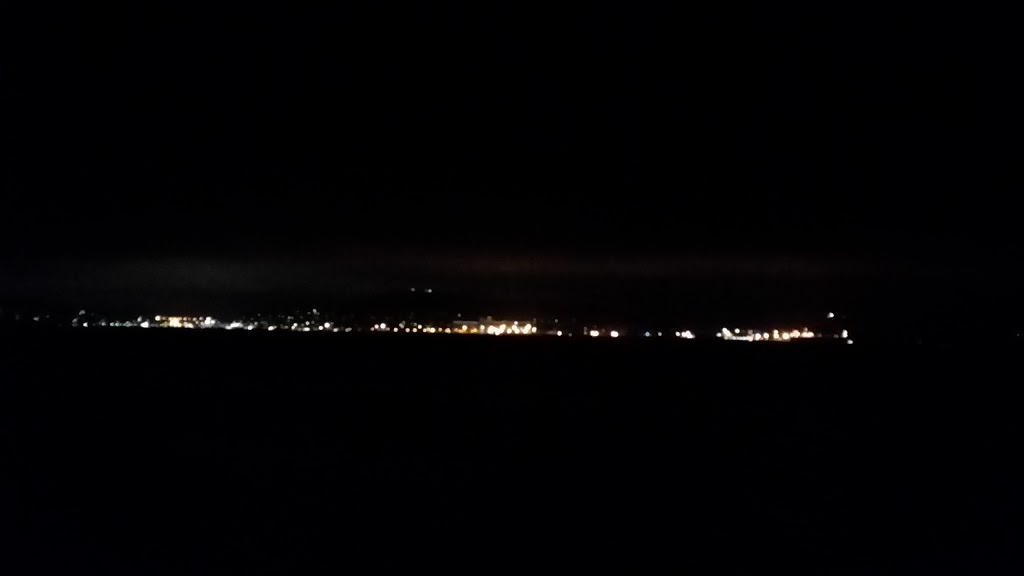
What are the coordinates of `picture` in the screenshot? It's located at (376, 397).